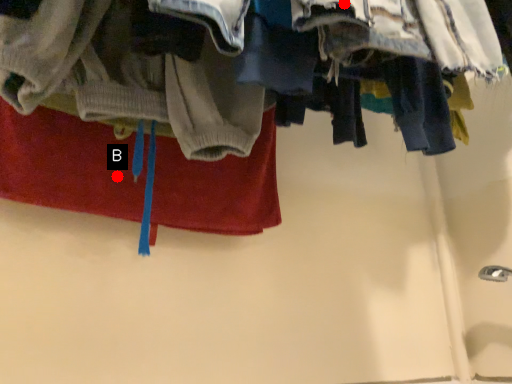
Question: Two points are circled on the image, labeled by A and B beside each circle. Which point appears farthest from the camera in this image?

Choices:
 (A) A is further
 (B) B is further

Answer: (B)